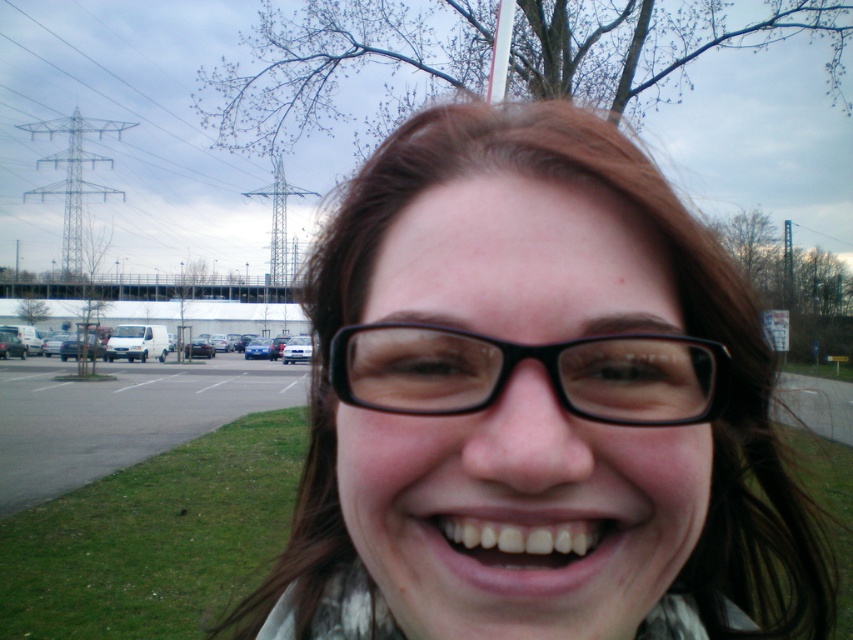
Is point (393, 429) farther from camera compared to point (703, 380)?

No.

What do you see at coordinates (537, 403) in the screenshot?
I see `black matte glasses at center` at bounding box center [537, 403].

Locate an element on the screen. black matte glasses at center is located at coordinates (537, 403).

Can you confirm if black plastic glasses at center is taller than white glossy teeth at center?

Indeed, black plastic glasses at center has a greater height compared to white glossy teeth at center.

Which is behind, point (405, 388) or point (523, 525)?

Point (405, 388)

You are a GUI agent. You are given a task and a screenshot of the screen. Output one action in this format:
    pyautogui.click(x=<x>, y=<y>)
    Task: Click on the black plastic glasses at center
    
    Given the screenshot: What is the action you would take?
    pyautogui.click(x=540, y=362)

Is black matte glasses at center to the left of white glossy teeth at center from the viewer's perspective?

In fact, black matte glasses at center is to the right of white glossy teeth at center.

Who is positioned more to the left, black matte glasses at center or white glossy teeth at center?

white glossy teeth at center

Locate an element on the screen. The width and height of the screenshot is (853, 640). black matte glasses at center is located at coordinates (537, 403).